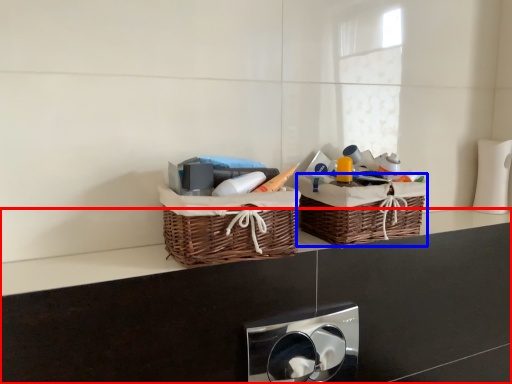
Question: Among these objects, which one is nearest to the camera, counter (highlighted by a red box) or picnic basket (highlighted by a blue box)?

Choices:
 (A) counter
 (B) picnic basket

Answer: (A)